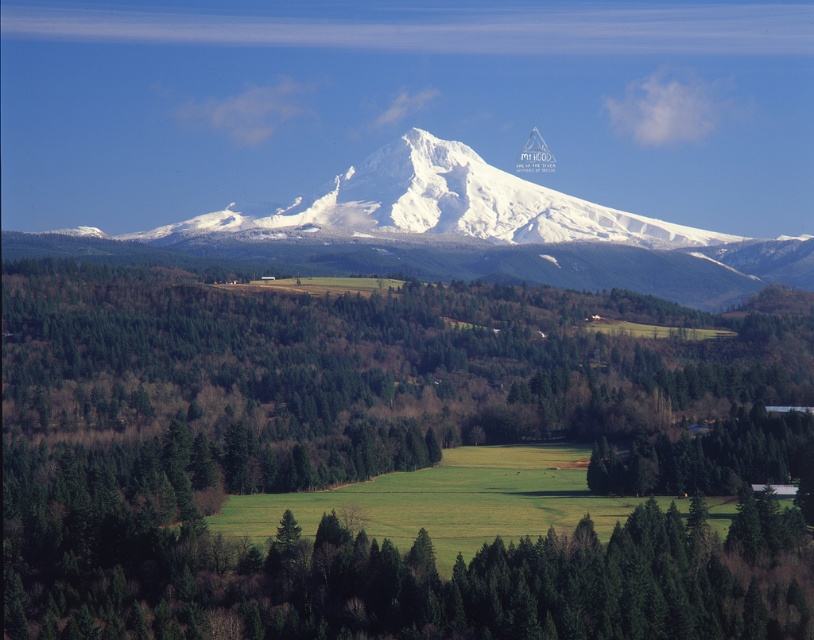
Can you confirm if green matte tree at center is wider than white snow-covered mountain at center?

No.

Does green matte tree at center have a smaller size compared to white snow-covered mountain at center?

Incorrect, green matte tree at center is not smaller in size than white snow-covered mountain at center.

Between point (464, 608) and point (82, 227), which one is positioned behind?

Point (82, 227)

Locate an element on the screen. This screenshot has height=640, width=814. green matte tree at center is located at coordinates (374, 460).